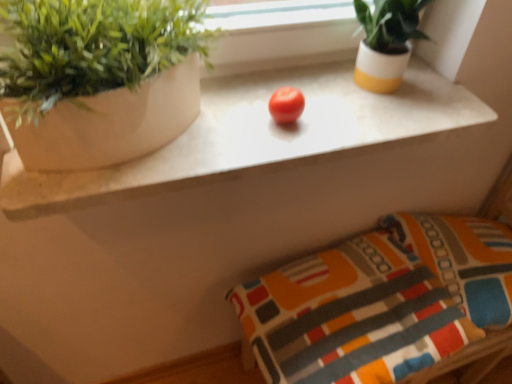
Where is `blank area to the left of red matte tomato at center`? The height and width of the screenshot is (384, 512). blank area to the left of red matte tomato at center is located at coordinates (215, 123).